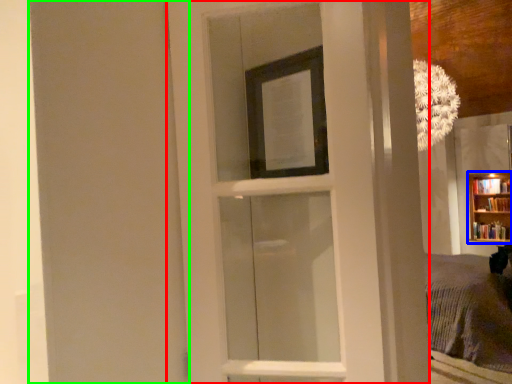
Question: Estimate the real-world distances between objects in this image. Which object is farther from door (highlighted by a red box), bookcase (highlighted by a blue box) or screen door (highlighted by a green box)?

Choices:
 (A) bookcase
 (B) screen door

Answer: (A)